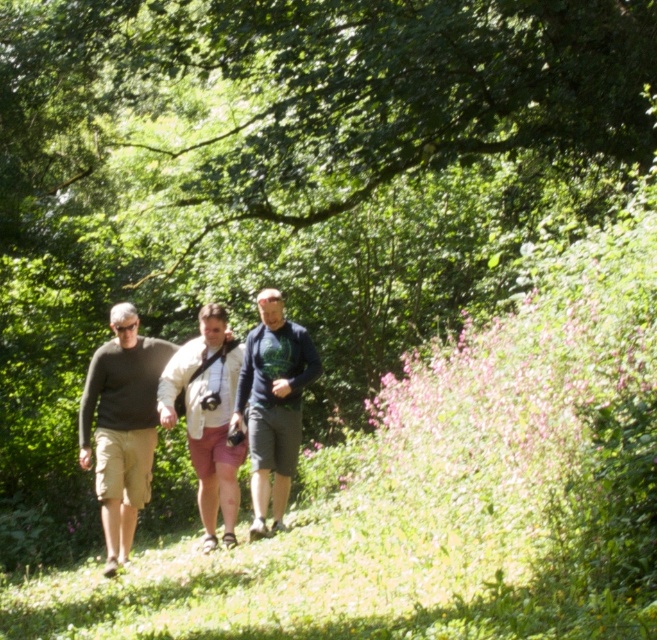
Question: Which of the following is the closest to the observer?

Choices:
 (A) light beige cotton shorts at center
 (B) dark gray sweater at center
 (C) dark green jersey at center
 (D) dark gray cotton shirt at center

Answer: (B)

Question: Is dark gray cotton shirt at center closer to camera compared to dark gray sweater at center?

Choices:
 (A) no
 (B) yes

Answer: (A)

Question: Can you confirm if dark green jersey at center is positioned above light beige cotton shorts at center?

Choices:
 (A) no
 (B) yes

Answer: (B)

Question: Estimate the real-world distances between objects in this image. Which object is farther from the dark gray cotton shirt at center?

Choices:
 (A) light beige cotton shorts at center
 (B) dark gray sweater at center

Answer: (B)

Question: Is dark gray cotton shirt at center wider than dark gray sweater at center?

Choices:
 (A) yes
 (B) no

Answer: (A)

Question: Which of these objects is positioned farthest from the dark green jersey at center?

Choices:
 (A) light beige cotton shorts at center
 (B) dark gray cotton shirt at center
 (C) dark gray sweater at center

Answer: (C)